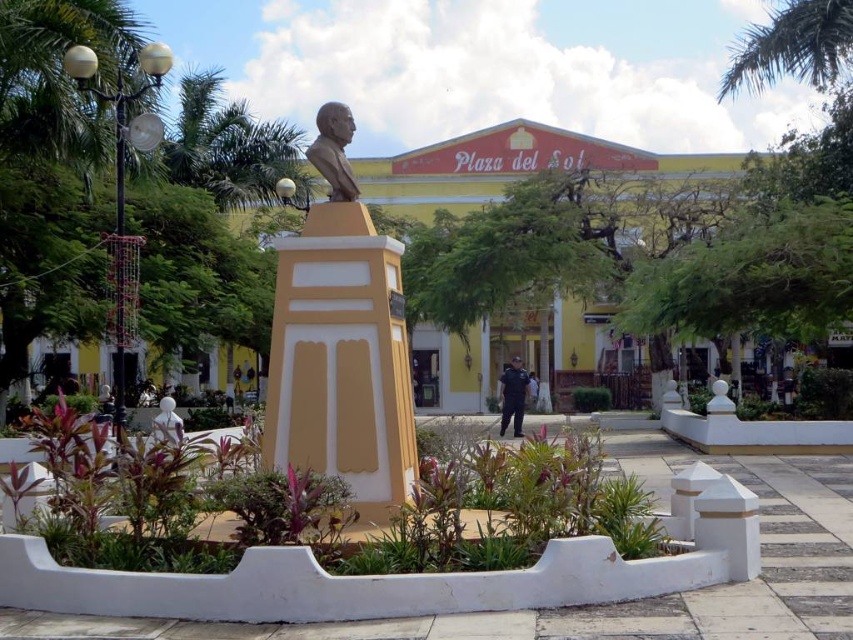
Is green leafy palm tree at upper left to the left of blue uniform at center from the viewer's perspective?

Correct, you'll find green leafy palm tree at upper left to the left of blue uniform at center.

Which is in front, point (247, 145) or point (508, 385)?

Point (508, 385) is more forward.

Measure the distance between green leafy palm tree at upper left and camera.

green leafy palm tree at upper left is 20.62 meters from camera.

Find the location of a particular element. green leafy palm tree at upper left is located at coordinates (228, 147).

Which is in front, point (274, 413) or point (277, 132)?

Point (274, 413)

At what (x,y) coordinates should I click in order to perform the action: click on matte gold bust at center. Please return your answer as a coordinate pair (x, y). Looking at the image, I should click on (341, 342).

Does point (366, 452) come behind point (192, 108)?

No, (366, 452) is closer to viewer.

You are a GUI agent. You are given a task and a screenshot of the screen. Output one action in this format:
    pyautogui.click(x=<x>, y=<y>)
    Task: Click on the matte gold bust at center
    This screenshot has width=853, height=640.
    Given the screenshot: What is the action you would take?
    pyautogui.click(x=341, y=342)

Can you confirm if yellow matte building at center is wider than bronze bust at center?

Correct, the width of yellow matte building at center exceeds that of bronze bust at center.

Is yellow matte building at center behind bronze bust at center?

Yes, it is.

Does point (672, 189) come farther from viewer compared to point (345, 118)?

Yes, point (672, 189) is behind point (345, 118).

Locate an element on the screen. The width and height of the screenshot is (853, 640). yellow matte building at center is located at coordinates (123, 272).